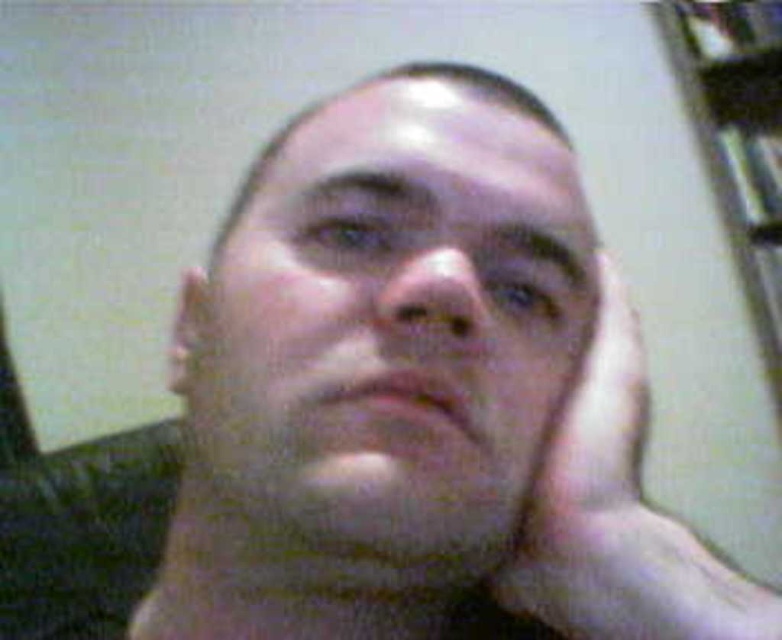
You are a photographer adjusting the focus on your camera. The subject is positioned in the center of the frame. Can you confirm if the smooth skin face at center is within the focus area of your camera, which is set to focus at the center point?

Yes, the smooth skin face at center is located at point (409, 304), which is within the focus area set at the center point.

Looking at the selfie, can you tell me the position of the smooth skin face at center relative to the white matte hand at center?

The smooth skin face at center is located to the left of the white matte hand at center.

You are holding a smartphone camera with a 12MP sensor. You want to take a selfie where your face fills the frame without any distortion. The recommended distance for optimal focus is between 12 to 16 inches. Based on the smooth skin face at center, will your current distance be sufficient for a clear, undistorted photo?

The smooth skin face at center is at a distance of 11.13 inches from the viewer. Since the recommended distance is between 12 to 16 inches, the current distance is slightly too close and may result in distortion. Move back a little to ensure the face fits the frame optimally without distortion.